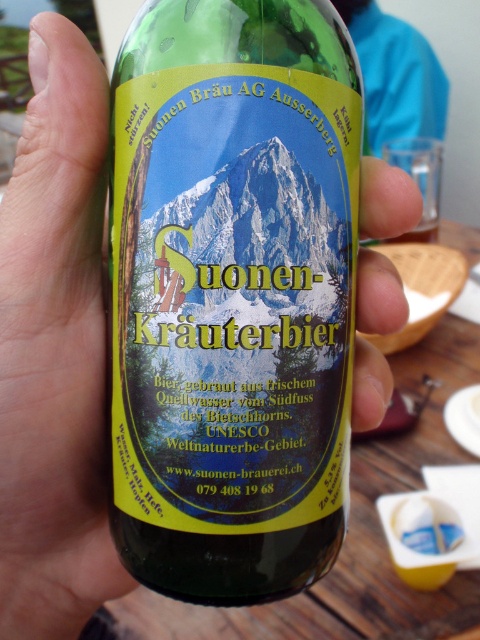
You are a photographer trying to capture the label of the green glass bottle. You notice two points marked on the label at coordinates point (173, 176) and point (96, 173). Which point is better to focus on to ensure the label appears sharp in your photo?

Point (173, 176) is closer to the camera than point (96, 173), so focusing on point (173, 176) will ensure the label appears sharp.

You are organizing a picnic and have both a green glass bottle at center and a transparent plastic bottle at center. If you want to choose the wider container for easier access to the contents, which one should you pick?

The green glass bottle at center is wider than the transparent plastic bottle at center, so you should pick the green glass bottle at center for easier access.

You are at a souvenir shop in Switzerland and see two bottles at the center of a display. The green glass bottle at center and the transparent plastic bottle at center. Which one is positioned higher?

The green glass bottle at center is positioned higher than the transparent plastic bottle at center.